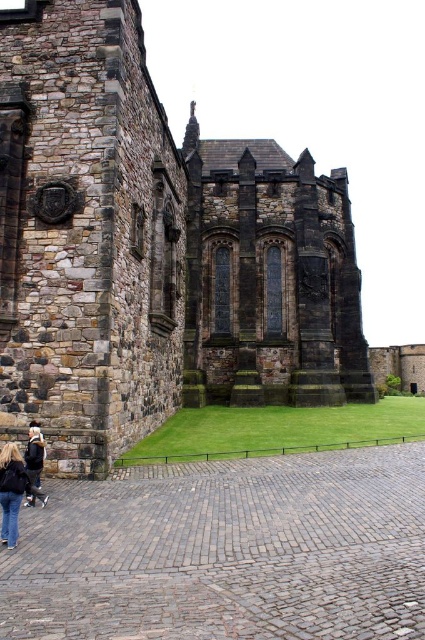
From the picture: You are a tourist visiting the historic stone building and see both the denim jacket at lower left and the dark brown leather jacket at lower left on the cobblestone path. Which jacket is wider?

The dark brown leather jacket at lower left is wider than the denim jacket at lower left.

You are standing in front of a historic stone building with a paved area. You see a denim jacket at lower left. Where exactly is the denim jacket located in terms of coordinates?

The denim jacket at lower left is located at coordinates point (13,492).